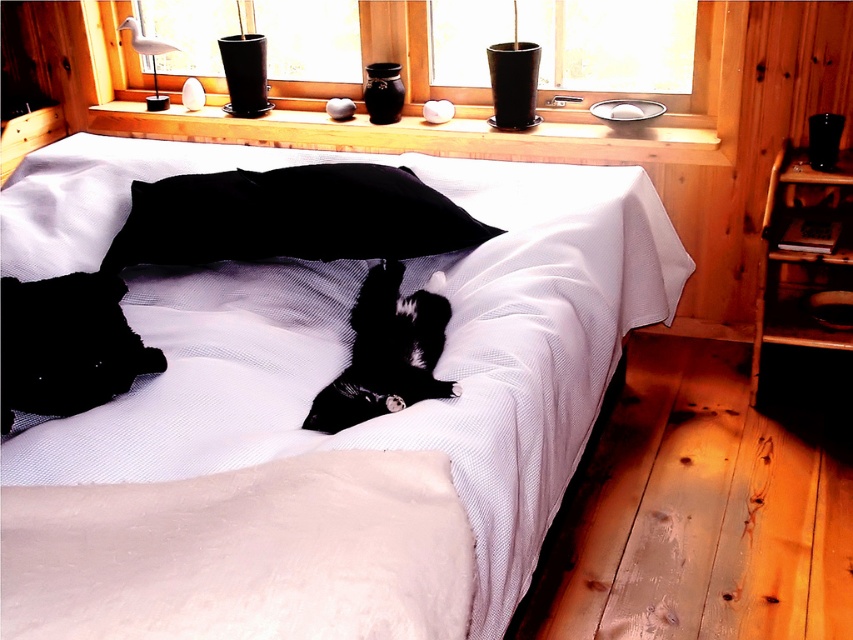
You are standing in the bedroom and want to place a new plant on the windowsill. The plant needs to be placed above the white textured bed at center. Can you place it there using the smooth glass window at center?

The white textured bed at center is located below the smooth glass window at center, so yes, you can place the plant on the windowsill above the white textured bed at center using the smooth glass window at center.

You are standing at the entrance of the bedroom and want to place a small decorative item on the black matte pillow at center. According to the scene description, where exactly is the black matte pillow located in relation to the bed?

The black matte pillow at center is positioned at the head of the bed against the window with a wooden frame.

You are arranging a small decorative item on the bed and need to ensure it fits between the black matte pillow at center and the smooth glass window at center. Given that the item is 20 cm wide, can it fit in the space between them?

The black matte pillow at center has a lesser width compared to smooth glass window at center, so the space between them is wider than 20 cm. Therefore, the decorative item can fit between them.